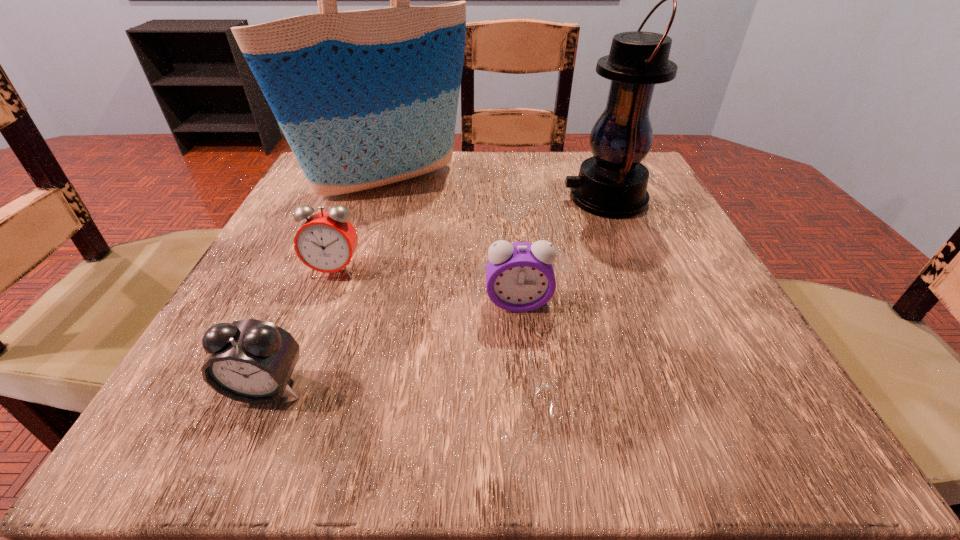
Locate an element on the screen. free space between the second farthest alarm clock and the nearest object is located at coordinates (392, 345).

Where is `vacant space in between the lantern and the nearest object`? This screenshot has width=960, height=540. vacant space in between the lantern and the nearest object is located at coordinates (435, 293).

Image resolution: width=960 pixels, height=540 pixels. Identify the location of free space between the tallest object and the nearest alarm clock. (325, 285).

Identify the location of free space that is in between the nearest alarm clock and the third farthest object. The width and height of the screenshot is (960, 540). (300, 329).

Locate an element on the screen. vacant space in between the third farthest object and the second tallest object is located at coordinates (469, 234).

What are the coordinates of `vacant area that lies between the farthest alarm clock and the tote bag` in the screenshot? It's located at (360, 226).

Find the location of a particular element. The height and width of the screenshot is (540, 960). empty location between the tote bag and the third nearest object is located at coordinates (360, 226).

Select which object is the second closest to the second nearest alarm clock. Please provide its 2D coordinates. Your answer should be formatted as a tuple, i.e. [(x, y)], where the tuple contains the x and y coordinates of a point satisfying the conditions above.

[(613, 183)]

Identify which object is located as the fourth nearest to the tallest object. Please provide its 2D coordinates. Your answer should be formatted as a tuple, i.e. [(x, y)], where the tuple contains the x and y coordinates of a point satisfying the conditions above.

[(251, 361)]

This screenshot has width=960, height=540. I want to click on alarm clock object that ranks as the closest to the fourth farthest object, so click(326, 242).